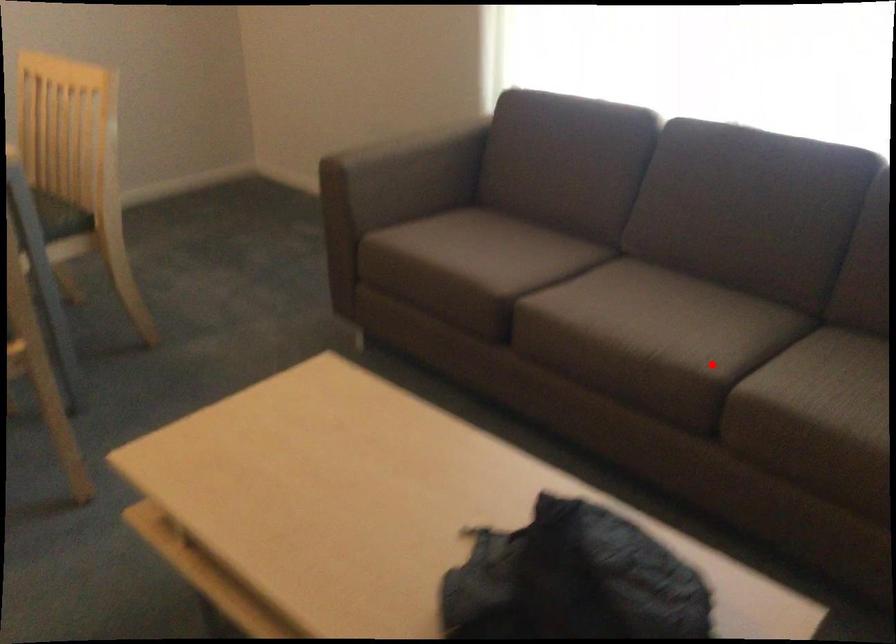
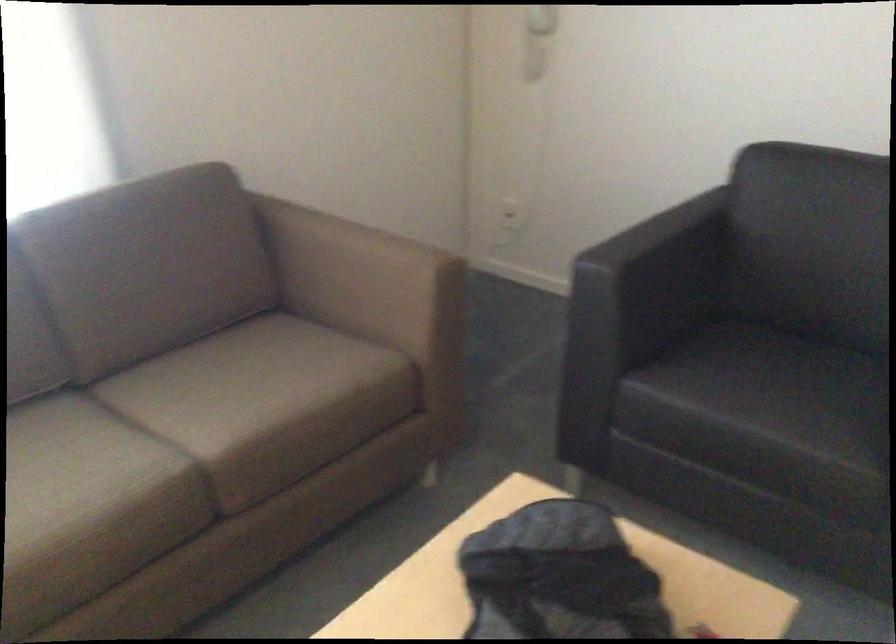
Where in the second image is the point corresponding to the highlighted location from the first image?

(179, 451)